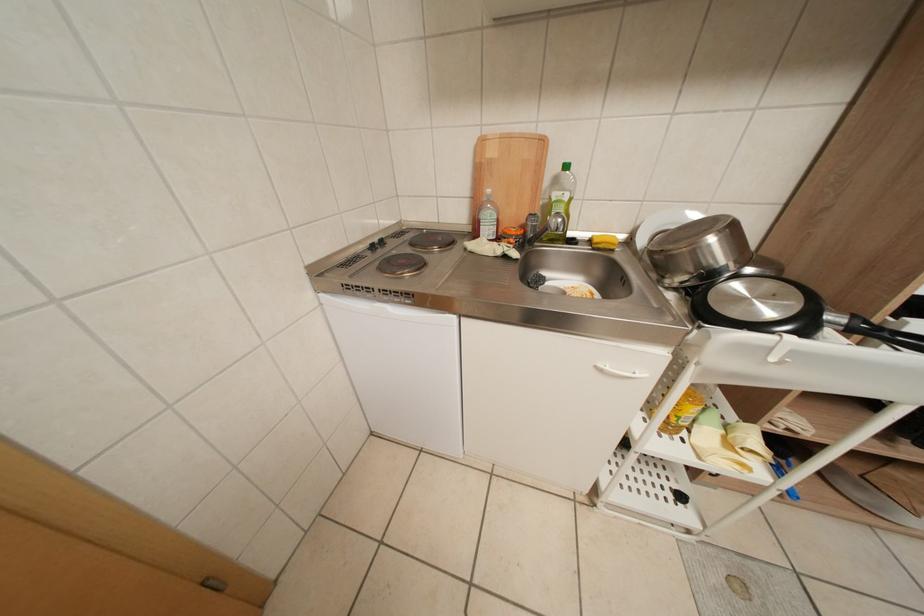
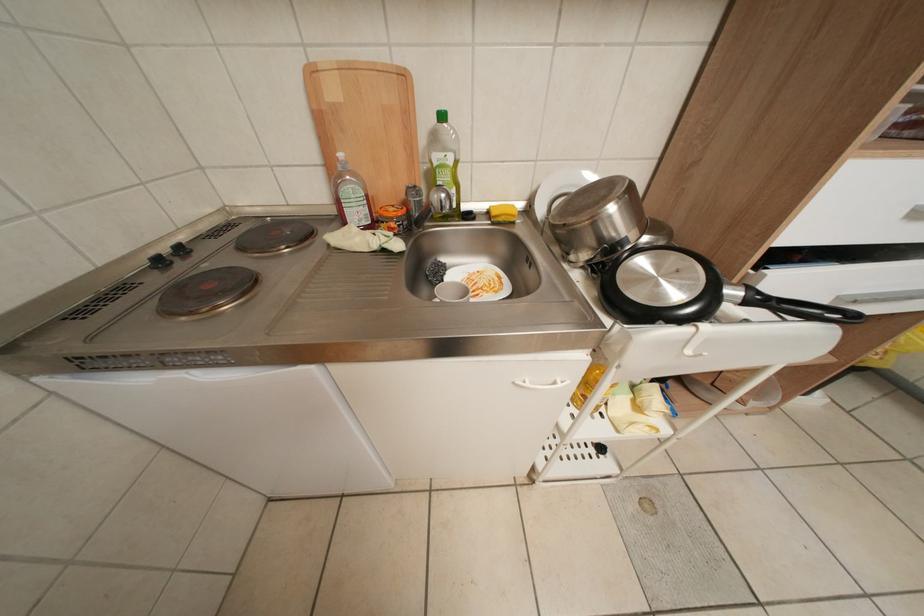
Question: The camera is either moving clockwise (left) or counter-clockwise (right) around the object. The first image is from the beginning of the video and the second image is from the end. Is the camera moving left or right when shooting the video?

Choices:
 (A) Left
 (B) Right

Answer: (A)